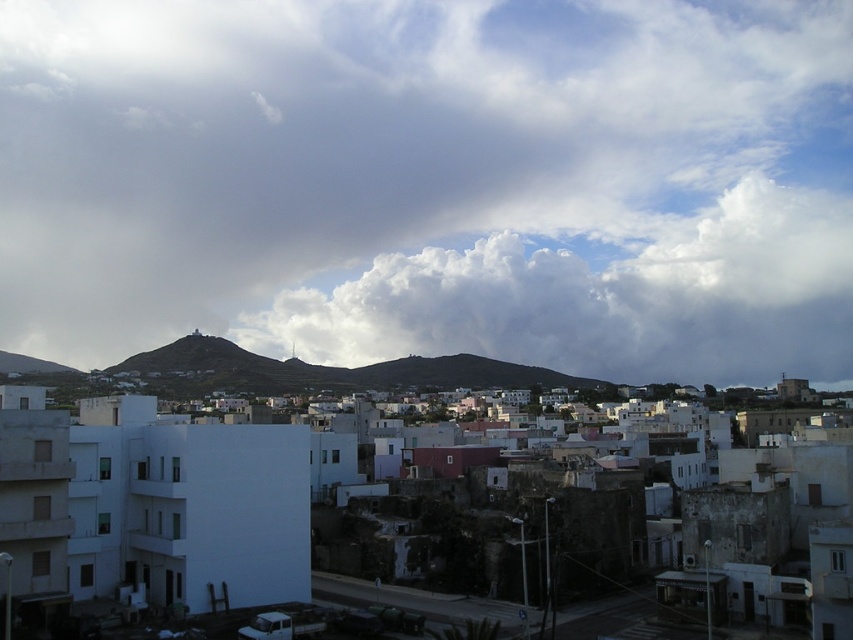
Question: Among these points, which one is nearest to the camera?

Choices:
 (A) (614, 232)
 (B) (808, 200)

Answer: (A)

Question: Can you confirm if white fluffy cloud at upper center is wider than white fluffy cloud at center?

Choices:
 (A) yes
 (B) no

Answer: (A)

Question: Which point appears farthest from the camera in this image?

Choices:
 (A) (315, 340)
 (B) (149, 296)

Answer: (B)

Question: Is white fluffy cloud at upper center wider than white fluffy cloud at center?

Choices:
 (A) yes
 (B) no

Answer: (A)

Question: Does white fluffy cloud at upper center have a greater width compared to white fluffy cloud at center?

Choices:
 (A) yes
 (B) no

Answer: (A)